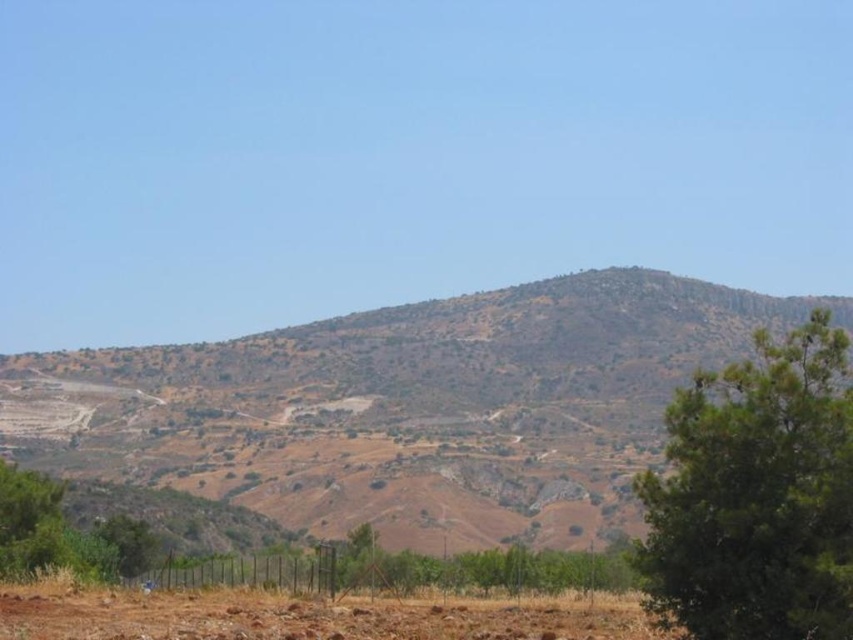
Question: Which is farther from the brown soil at lower center?

Choices:
 (A) green textured tree at right
 (B) brown rocky mountain at center

Answer: (B)

Question: From the image, what is the correct spatial relationship of brown rocky mountain at center in relation to green textured tree at right?

Choices:
 (A) left
 (B) right

Answer: (B)

Question: From the image, what is the correct spatial relationship of brown rocky mountain at center in relation to green textured tree at right?

Choices:
 (A) above
 (B) below

Answer: (A)

Question: Which object appears closest to the camera in this image?

Choices:
 (A) brown rocky mountain at center
 (B) brown soil at lower center

Answer: (A)

Question: Which point is closer to the camera?

Choices:
 (A) green textured tree at right
 (B) brown rocky mountain at center

Answer: (A)

Question: Is brown rocky mountain at center above green textured tree at right?

Choices:
 (A) no
 (B) yes

Answer: (B)